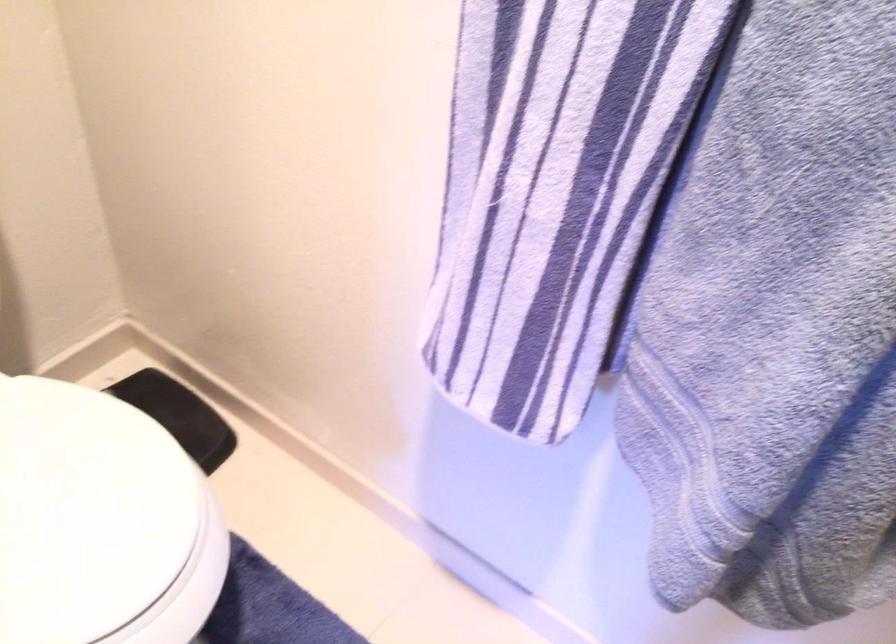
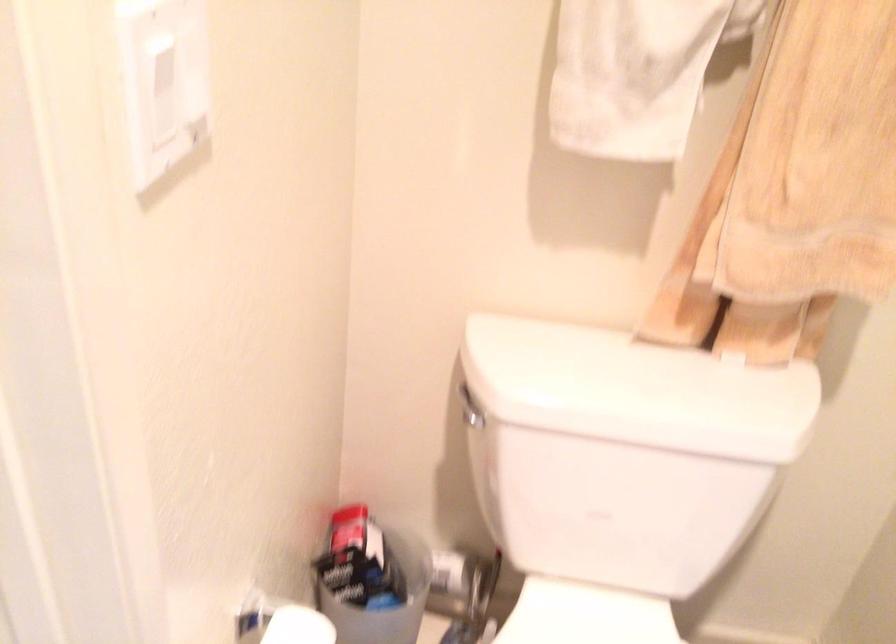
Question: How did the camera likely rotate?

Choices:
 (A) Left
 (B) Right
 (C) Up
 (D) Down

Answer: (A)